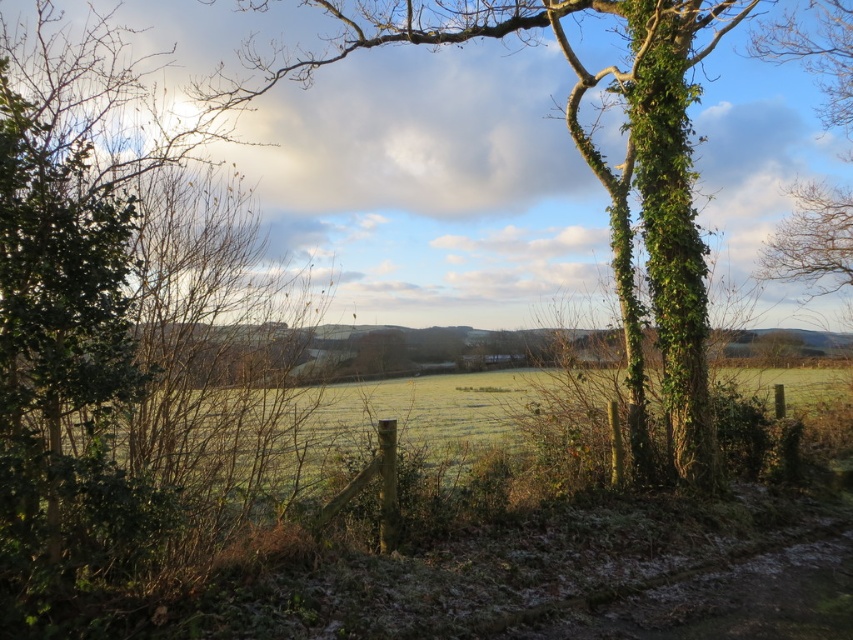
Question: Which object is closer to the camera taking this photo?

Choices:
 (A) green leafy tree at left
 (B) green ivy-covered tree at center

Answer: (A)

Question: Is green leafy tree at left to the right of green ivy-covered tree at center from the viewer's perspective?

Choices:
 (A) yes
 (B) no

Answer: (B)

Question: Is green leafy tree at left above green ivy-covered tree at center?

Choices:
 (A) no
 (B) yes

Answer: (A)

Question: Is green leafy tree at left below green ivy-covered tree at center?

Choices:
 (A) yes
 (B) no

Answer: (A)